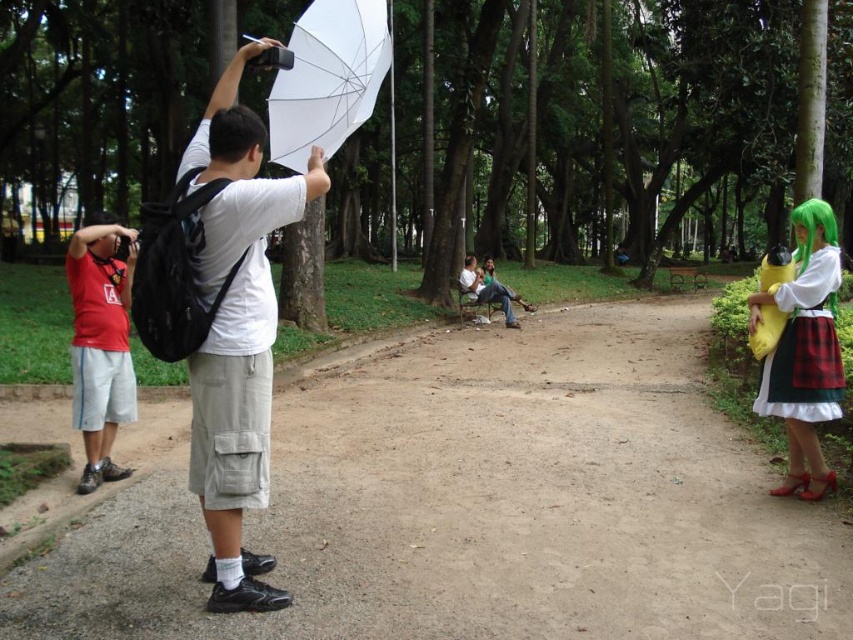
You are a hiker who wants to take a photo of the matte green wig at right without stepping off the dirt path at center. Is this possible?

The dirt path at center is positioned under matte green wig at right, so yes, you can take a photo of the matte green wig at right while standing on the dirt path at center without needing to step off.

You are standing at point (351, 58) and want to walk to point (355, 378). Is the destination point behind you or in front of you?

The destination point (355, 378) is behind you relative to your current position at point (351, 58).